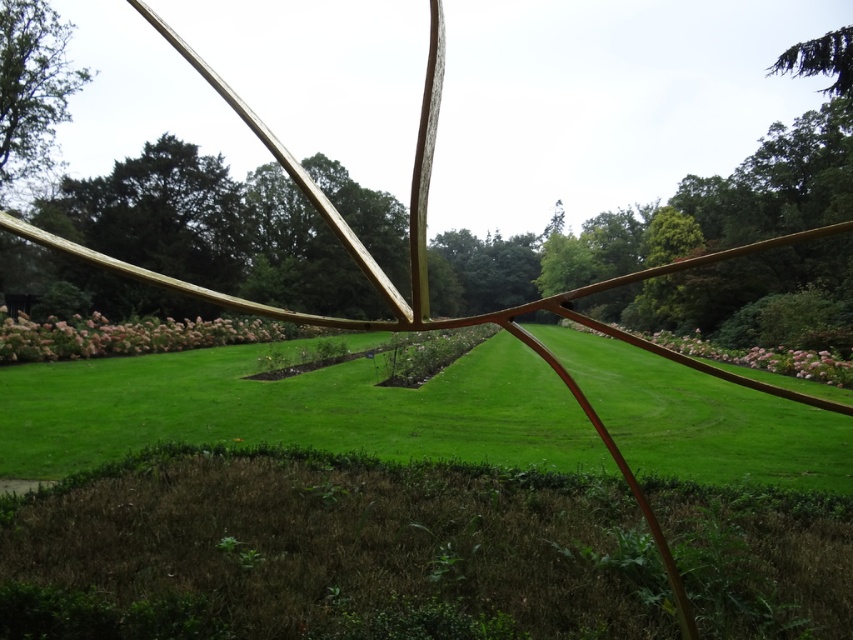
Question: Which object is the farthest from the pink fluffy flowers at center?

Choices:
 (A) pink fluffy grass at center
 (B) green grass at center
 (C) wooden sculpture at center
 (D) green leafy tree at upper left

Answer: (D)

Question: Does green leafy tree at upper left appear on the right side of pink fluffy flowers at center?

Choices:
 (A) yes
 (B) no

Answer: (B)

Question: Can you confirm if green grass at center is positioned above green leafy tree at upper left?

Choices:
 (A) yes
 (B) no

Answer: (B)

Question: Which object appears farthest from the camera in this image?

Choices:
 (A) green leafy tree at upper left
 (B) pink fluffy flowers at center

Answer: (A)

Question: Which object is closer to the camera taking this photo?

Choices:
 (A) pink fluffy grass at center
 (B) pink fluffy flowers at center

Answer: (B)

Question: Where is wooden sculpture at center located in relation to pink fluffy flowers at center in the image?

Choices:
 (A) below
 (B) above

Answer: (B)